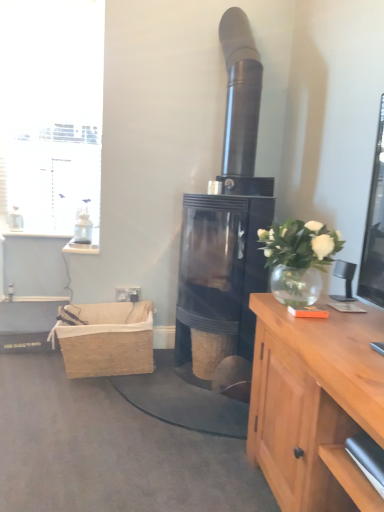
What are the coordinates of `free space on the front side of black glass fireplace at center` in the screenshot? It's located at (178, 425).